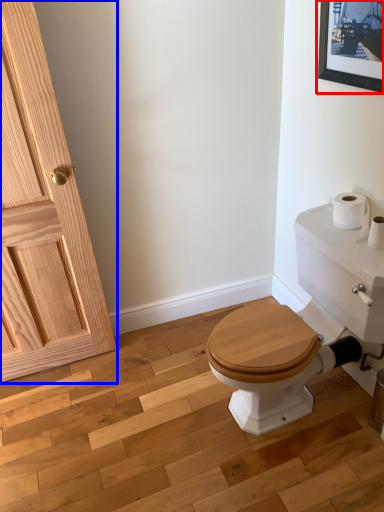
Question: Which object is further to the camera taking this photo, picture frame (highlighted by a red box) or door (highlighted by a blue box)?

Choices:
 (A) picture frame
 (B) door

Answer: (A)